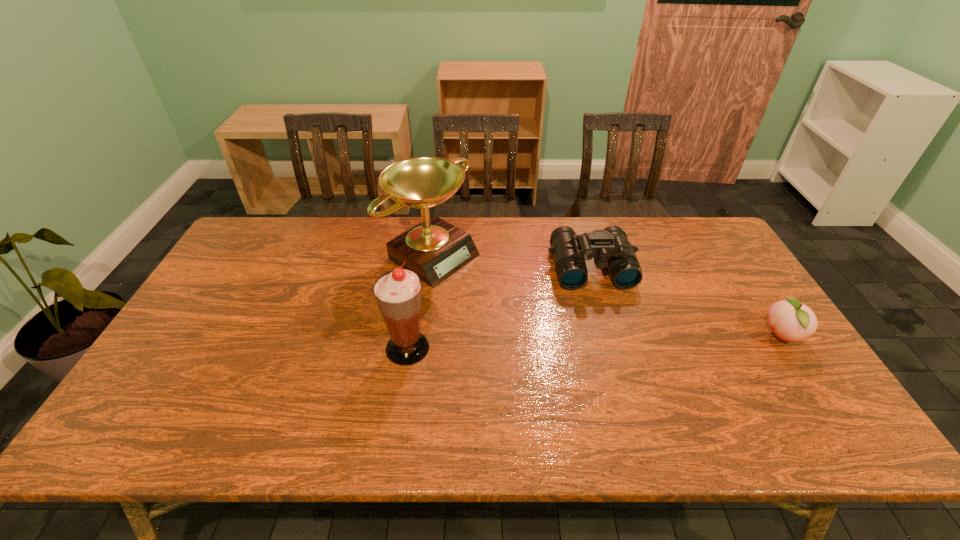
Locate an element on the screen. The image size is (960, 540). smoothie is located at coordinates (398, 293).

You are a GUI agent. You are given a task and a screenshot of the screen. Output one action in this format:
    pyautogui.click(x=<x>, y=<y>)
    Task: Click on the shortest object
    Image resolution: width=960 pixels, height=540 pixels.
    Given the screenshot: What is the action you would take?
    tap(792, 321)

Locate an element on the screen. This screenshot has height=540, width=960. peach is located at coordinates (792, 321).

Where is `binoculars`? binoculars is located at coordinates (610, 248).

Locate an element on the screen. Image resolution: width=960 pixels, height=540 pixels. the third object from left to right is located at coordinates pyautogui.click(x=610, y=248).

Where is `award`? This screenshot has height=540, width=960. award is located at coordinates (434, 249).

Image resolution: width=960 pixels, height=540 pixels. What are the coordinates of `vacant space situated 0.120m on the left of the smoothie` in the screenshot? It's located at (340, 348).

Image resolution: width=960 pixels, height=540 pixels. What are the coordinates of `free space located on the left of the shortest object` in the screenshot? It's located at (674, 336).

The height and width of the screenshot is (540, 960). In order to click on vacant space positioned 0.320m through the lenses of the binoculars in this screenshot , I will do `click(626, 381)`.

Locate an element on the screen. The height and width of the screenshot is (540, 960). free space located through the lenses of the binoculars is located at coordinates (602, 303).